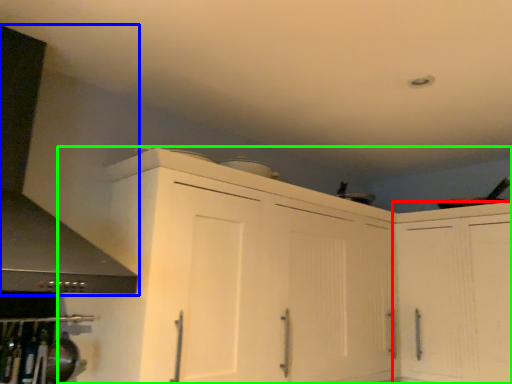
Question: Which object is positioned closest to cabinetry (highlighted by a red box)? Select from exhaust hood (highlighted by a blue box) and cabinetry (highlighted by a green box).

Choices:
 (A) exhaust hood
 (B) cabinetry

Answer: (B)